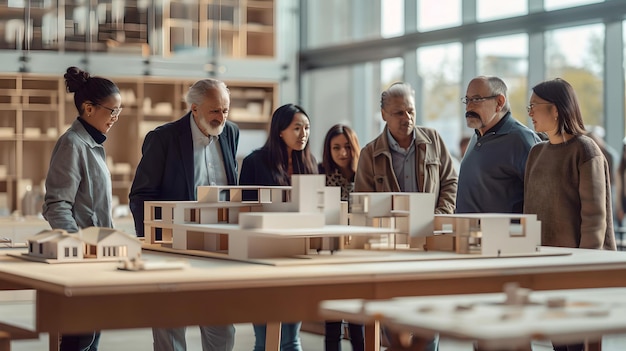
Locate an element on the screen. The image size is (626, 351). windows is located at coordinates (389, 68), (506, 47), (578, 55), (437, 8), (434, 63), (506, 6), (390, 23), (330, 105), (326, 26).